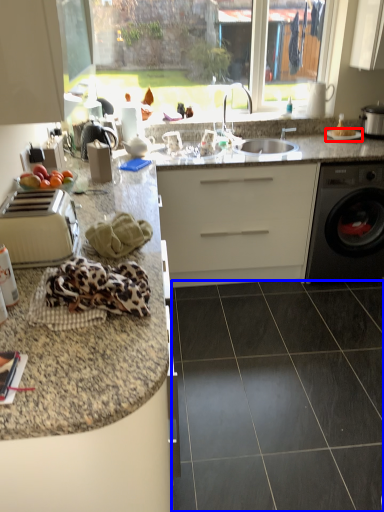
Question: Which point is further to the camera, gas stove (highlighted by a red box) or granite (highlighted by a blue box)?

Choices:
 (A) gas stove
 (B) granite

Answer: (A)